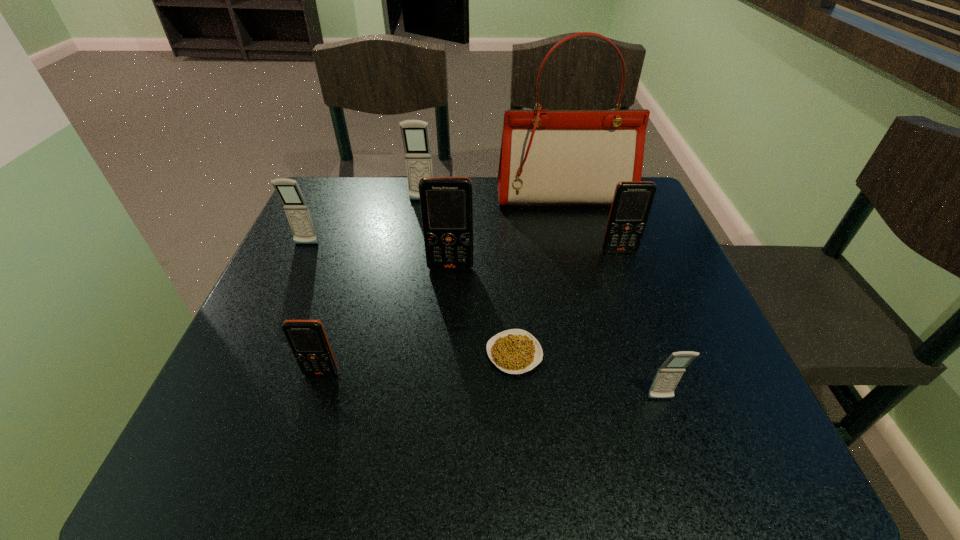
This screenshot has width=960, height=540. Find the location of `free location at the right edge of the desktop`. free location at the right edge of the desktop is located at coordinates (635, 312).

Locate an element on the screen. vacant space at the far left corner of the desktop is located at coordinates (316, 227).

In the image, there is a desktop. At what (x,y) coordinates should I click in order to perform the action: click on vacant space at the far right corner. Please return your answer as a coordinate pair (x, y). Image resolution: width=960 pixels, height=540 pixels. Looking at the image, I should click on (595, 207).

This screenshot has height=540, width=960. Identify the location of free space at the near right corner of the desktop. (732, 446).

Locate an element on the screen. vacant area that lies between the fourth nearest object and the second biggest orange cellular telephone is located at coordinates (535, 259).

Locate an element on the screen. This screenshot has height=540, width=960. blank region between the nearest orange cellular telephone and the tallest object is located at coordinates (443, 285).

You are a GUI agent. You are given a task and a screenshot of the screen. Output one action in this format:
    pyautogui.click(x=<x>, y=<y>)
    Task: Click on the free area in between the farthest orange cellular telephone and the nearest object
    
    Given the screenshot: What is the action you would take?
    pyautogui.click(x=640, y=325)

Identify the location of vacant point located between the smallest gray cellular telephone and the shortest object. This screenshot has height=540, width=960. (588, 376).

The height and width of the screenshot is (540, 960). Find the location of `vacant point located between the shortest object and the rightmost gray cellular telephone`. vacant point located between the shortest object and the rightmost gray cellular telephone is located at coordinates (588, 376).

The image size is (960, 540). What are the coordinates of `empty location between the second farthest cellular telephone and the legume` in the screenshot? It's located at (410, 299).